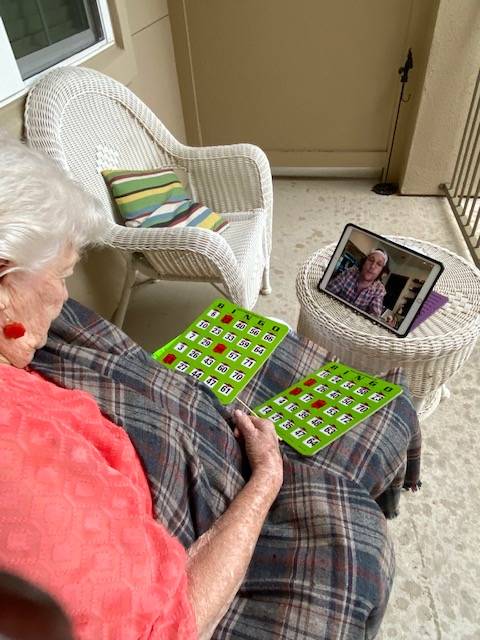
Find the location of a particular element. Image resolution: width=480 pixels, height=640 pixels. window is located at coordinates (33, 18).